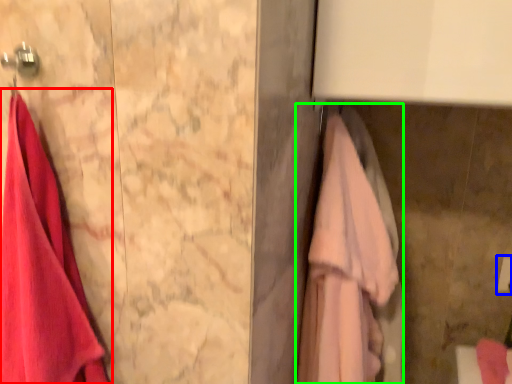
Question: Based on their relative distances, which object is nearer to towel (highlighted by a red box)? Choose from towel bar (highlighted by a blue box) and towel (highlighted by a green box).

Choices:
 (A) towel bar
 (B) towel

Answer: (B)